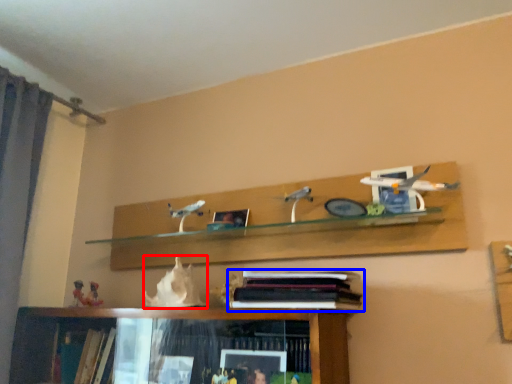
Question: Among these objects, which one is farthest to the camera, animal (highlighted by a red box) or book (highlighted by a blue box)?

Choices:
 (A) animal
 (B) book

Answer: (A)